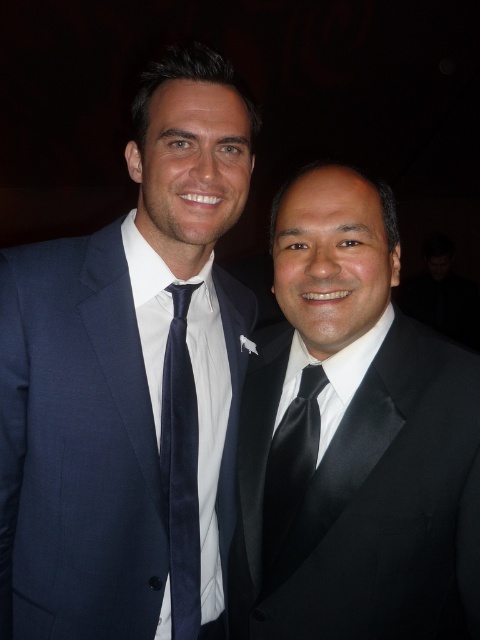
Question: Can you confirm if navy blue suit at left is positioned to the right of black satin suit at right?

Choices:
 (A) yes
 (B) no

Answer: (B)

Question: Is navy velvet tie at center behind black satin tie at center?

Choices:
 (A) yes
 (B) no

Answer: (A)

Question: Based on their relative distances, which object is nearer to the black satin suit at right?

Choices:
 (A) navy velvet tie at center
 (B) navy blue suit at left
 (C) black satin tie at center

Answer: (C)

Question: Is navy blue suit at left positioned before navy velvet tie at center?

Choices:
 (A) yes
 (B) no

Answer: (A)

Question: Which object appears closest to the camera in this image?

Choices:
 (A) black satin suit at right
 (B) navy velvet tie at center
 (C) black satin tie at center

Answer: (A)

Question: Which object appears closest to the camera in this image?

Choices:
 (A) black satin suit at right
 (B) navy blue suit at left

Answer: (A)